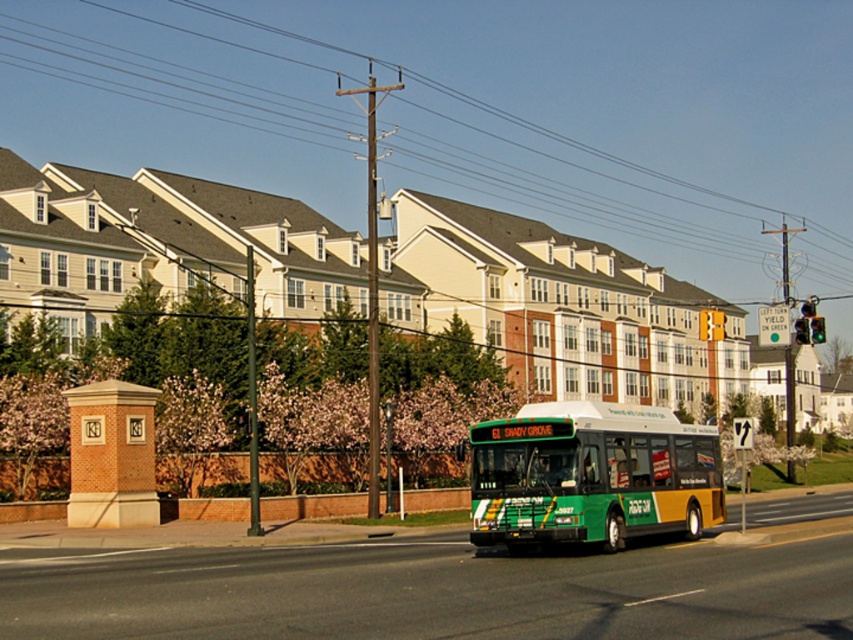
You are a delivery driver approaching the intersection shown in the image. You need to determine if the green glass traffic light at center is visible from your current position. Can you see it without obstruction from the brown wooden power line at upper center?

The brown wooden power line at upper center is located above the green glass traffic light at center, so the traffic light is partially or fully obscured by the power line, making it difficult to see clearly from your current position.